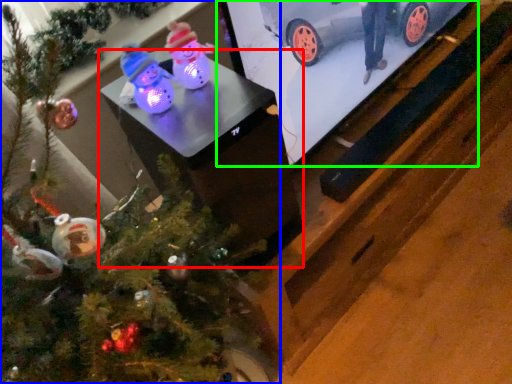
Question: Considering the real-world distances, which object is farthest from table (highlighted by a red box)? christmas tree (highlighted by a blue box) or tv show (highlighted by a green box)?

Choices:
 (A) christmas tree
 (B) tv show

Answer: (B)